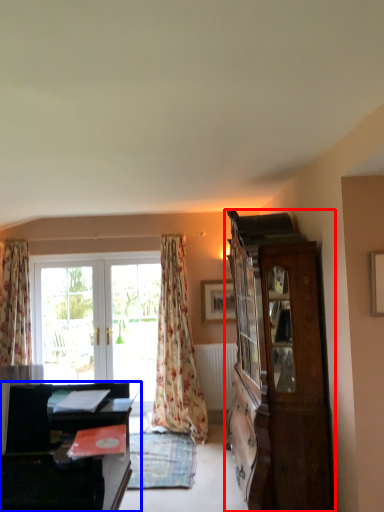
Question: Which of the following is the farthest to the observer, cabinetry (highlighted by a red box) or desk (highlighted by a blue box)?

Choices:
 (A) cabinetry
 (B) desk

Answer: (A)